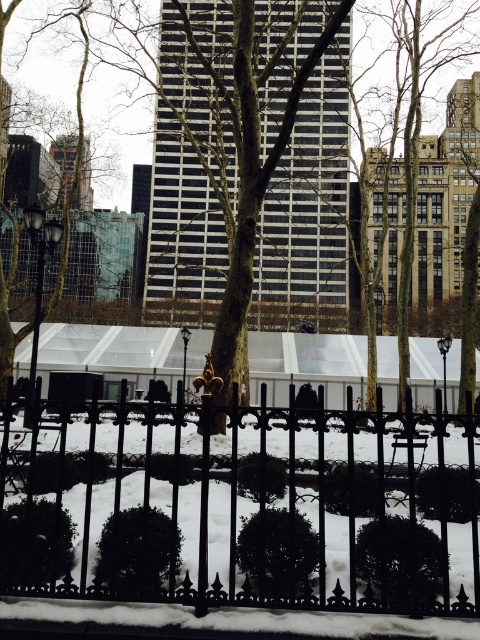
You are standing at the point marked as point (252, 516) in the image. Based on the scene description, what object are you most likely standing in front of?

The point (252, 516) indicates the black wrought iron fence at lower center, so you are most likely standing in front of the black wrought iron fence at lower center.

You are standing in the winter scene and want to walk from the black wrought iron fence at lower center to the brown textured tree at center. Which direction should you move to reach the tree?

You should move to the right to reach the brown textured tree at center because the black wrought iron fence at lower center is located to the left of it.

You are standing in the urban winter scene and want to walk from the black wrought iron fence to the large white tent. Which point, point (255, 550) or point (336, 246), would you encounter first along your path?

You would encounter point (255, 550) first because it is closer to the viewer than point (336, 246).